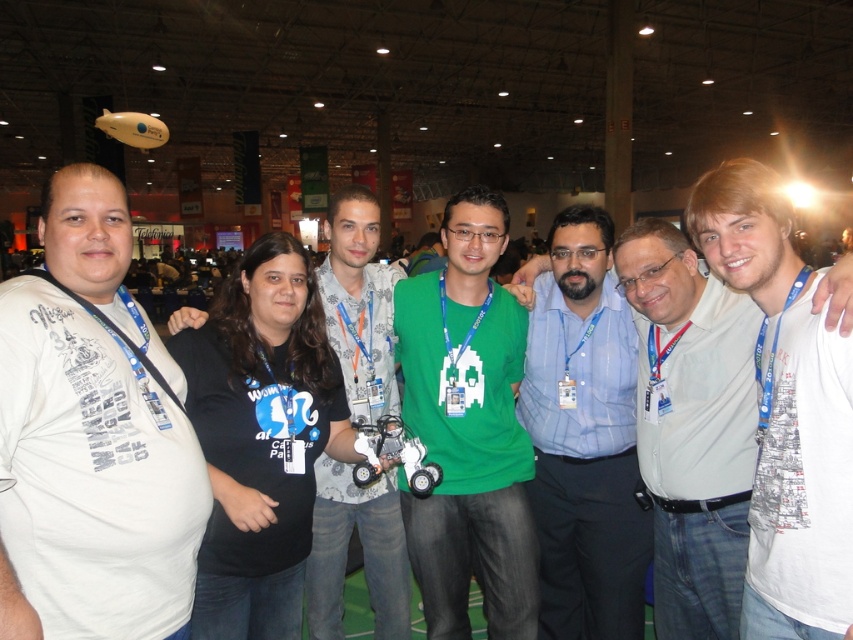
Which is more to the right, blue shirt at center or light blue button-down shirt at center?

light blue button-down shirt at center is more to the right.

Which is above, blue shirt at center or light blue button-down shirt at center?

light blue button-down shirt at center is higher up.

Is point (566, 349) in front of point (850, 300)?

No, (566, 349) is behind (850, 300).

Find the location of a particular element. blue shirt at center is located at coordinates (584, 438).

Between white printed tank top at right and blue shirt at center, which one is positioned lower?

blue shirt at center is below.

Between white printed tank top at right and blue shirt at center, which one is positioned higher?

white printed tank top at right is above.

Does point (817, 424) come closer to viewer compared to point (606, 328)?

Yes, it is in front of point (606, 328).

Image resolution: width=853 pixels, height=640 pixels. In order to click on white printed tank top at right in this screenshot , I will do `click(786, 412)`.

Which of these two, green matte shirt at center or white printed tank top at right, stands taller?

With more height is green matte shirt at center.

Who is positioned more to the left, green matte shirt at center or white printed tank top at right?

From the viewer's perspective, green matte shirt at center appears more on the left side.

Which is in front, point (460, 253) or point (817, 376)?

Positioned in front is point (817, 376).

The height and width of the screenshot is (640, 853). In order to click on green matte shirt at center in this screenshot , I will do `click(468, 428)`.